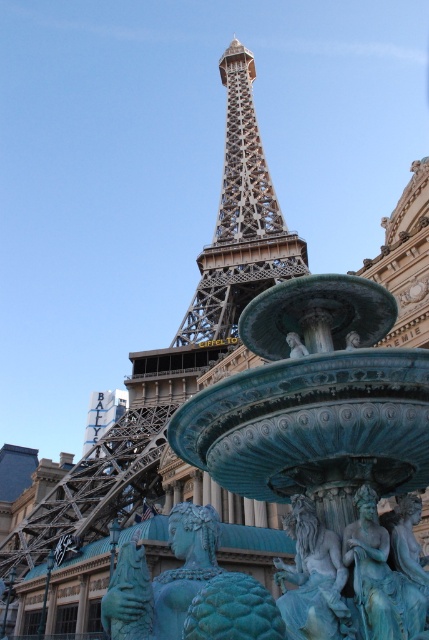
Question: Is metallic brown eiffel tower at center positioned in front of teal patina mermaid at center?

Choices:
 (A) yes
 (B) no

Answer: (B)

Question: Which point is closer to the camera?

Choices:
 (A) (302, 522)
 (B) (299, 241)
 (C) (368, 493)

Answer: (C)

Question: Based on their relative distances, which object is nearer to the metallic brown eiffel tower at center?

Choices:
 (A) teal stone lion at center
 (B) teal patina mermaid at center
 (C) green patina statue at center

Answer: (A)

Question: Is teal patina mermaid at center above green patina statue at center?

Choices:
 (A) no
 (B) yes

Answer: (A)

Question: Which point is closer to the camera taking this photo?

Choices:
 (A) (232, 100)
 (B) (347, 541)
 (C) (239, 580)

Answer: (C)

Question: Observing the image, what is the correct spatial positioning of metallic brown eiffel tower at center in reference to green patina statue at center?

Choices:
 (A) below
 (B) above

Answer: (B)